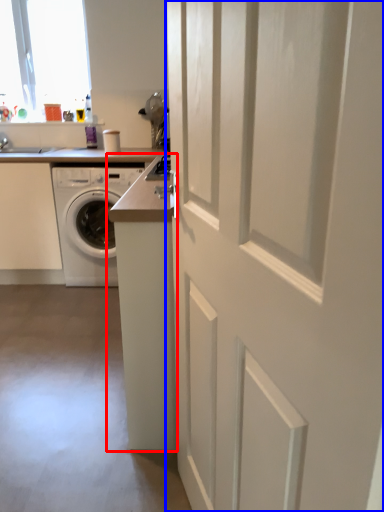
Question: Which point is closer to the camera, counter (highlighted by a red box) or door (highlighted by a blue box)?

Choices:
 (A) counter
 (B) door

Answer: (B)